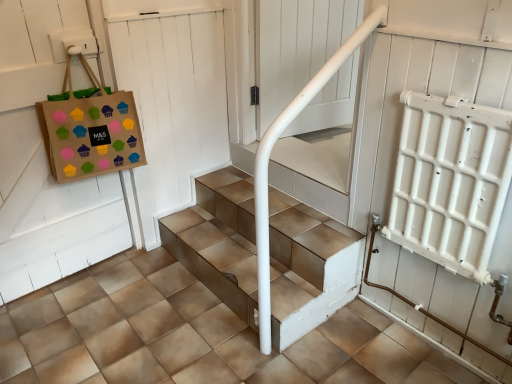
Question: Can you confirm if brown paper bag with colorful cupcake stickers at upper left is taller than white wooden door at upper left?

Choices:
 (A) yes
 (B) no

Answer: (B)

Question: Does brown paper bag with colorful cupcake stickers at upper left touch white wooden door at upper left?

Choices:
 (A) yes
 (B) no

Answer: (B)

Question: Considering the relative sizes of brown paper bag with colorful cupcake stickers at upper left and white wooden door at upper left in the image provided, is brown paper bag with colorful cupcake stickers at upper left thinner than white wooden door at upper left?

Choices:
 (A) no
 (B) yes

Answer: (A)

Question: Is brown paper bag with colorful cupcake stickers at upper left completely or partially outside of white wooden door at upper left?

Choices:
 (A) yes
 (B) no

Answer: (A)

Question: Is brown paper bag with colorful cupcake stickers at upper left to the left of white wooden door at upper left from the viewer's perspective?

Choices:
 (A) no
 (B) yes

Answer: (B)

Question: Is metallic tile stairs at center inside or outside of brown tile concrete at center?

Choices:
 (A) inside
 (B) outside

Answer: (B)

Question: Is metallic tile stairs at center taller or shorter than brown tile concrete at center?

Choices:
 (A) tall
 (B) short

Answer: (A)

Question: Is point (231, 246) closer or farther from the camera than point (346, 367)?

Choices:
 (A) closer
 (B) farther

Answer: (B)

Question: In terms of width, does metallic tile stairs at center look wider or thinner when compared to brown tile concrete at center?

Choices:
 (A) wide
 (B) thin

Answer: (B)

Question: Considering their positions, is brown paper bag with colorful cupcake stickers at upper left located in front of or behind brown tile concrete at center?

Choices:
 (A) behind
 (B) front

Answer: (A)

Question: Is brown paper bag with colorful cupcake stickers at upper left wider or thinner than brown tile concrete at center?

Choices:
 (A) thin
 (B) wide

Answer: (A)

Question: From a real-world perspective, is brown paper bag with colorful cupcake stickers at upper left above or below brown tile concrete at center?

Choices:
 (A) above
 (B) below

Answer: (A)

Question: Does point (80, 140) appear closer or farther from the camera than point (98, 266)?

Choices:
 (A) closer
 (B) farther

Answer: (A)

Question: From a real-world perspective, is white wooden door at upper left positioned above or below white glossy handrail at upper center?

Choices:
 (A) above
 (B) below

Answer: (B)

Question: Is white wooden door at upper left taller or shorter than white glossy handrail at upper center?

Choices:
 (A) tall
 (B) short

Answer: (A)